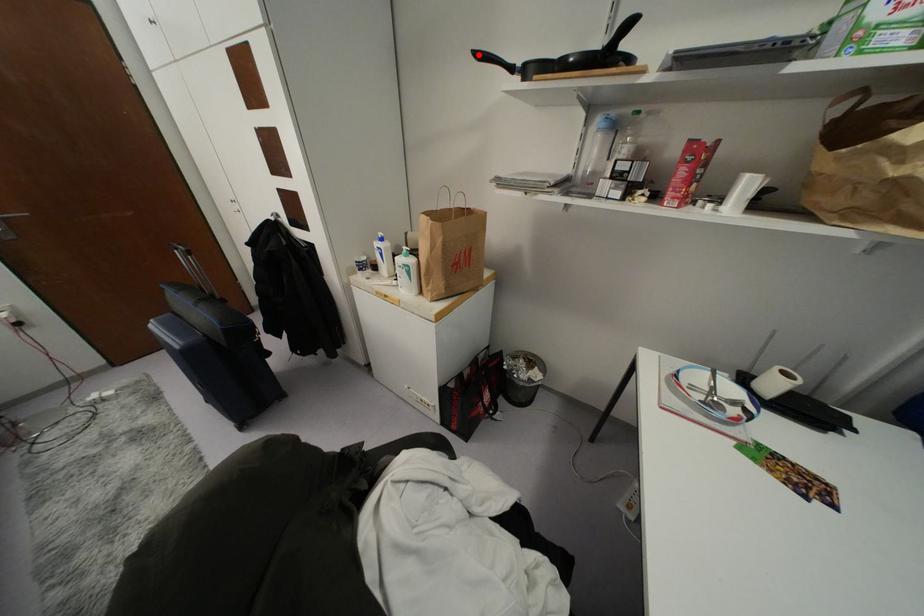
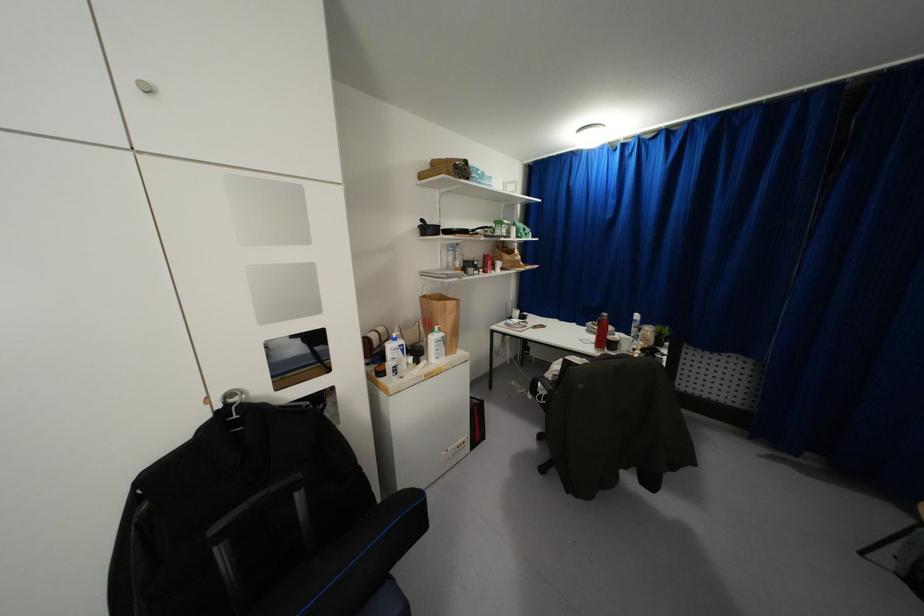
Where in the second image is the point corresponding to the highlighted location from the first image?

(421, 220)